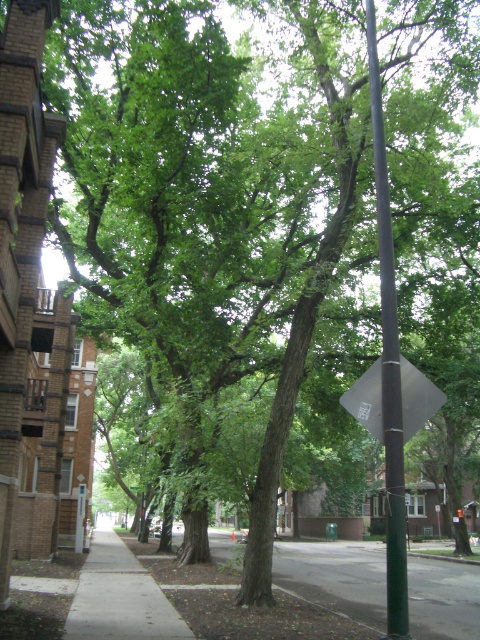
Question: Is green metallic pole at center smaller than black plastic diamond at center-right?

Choices:
 (A) yes
 (B) no

Answer: (A)

Question: Which point is closer to the camera?

Choices:
 (A) black plastic diamond at center-right
 (B) gray concrete sidewalk at lower left

Answer: (A)

Question: Which object appears closest to the camera in this image?

Choices:
 (A) green metallic pole at center
 (B) black plastic diamond at center-right

Answer: (A)

Question: Is green metallic pole at center to the right of gray concrete sidewalk at lower left from the viewer's perspective?

Choices:
 (A) yes
 (B) no

Answer: (A)

Question: Which object appears closest to the camera in this image?

Choices:
 (A) gray concrete sidewalk at lower left
 (B) black plastic diamond at center-right

Answer: (B)

Question: Does gray concrete sidewalk at lower left appear over black plastic diamond at center-right?

Choices:
 (A) no
 (B) yes

Answer: (A)